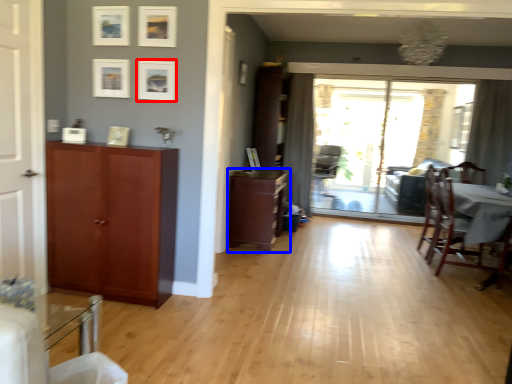
Question: Among these objects, which one is farthest to the camera, picture frame (highlighted by a red box) or cabinetry (highlighted by a blue box)?

Choices:
 (A) picture frame
 (B) cabinetry

Answer: (B)